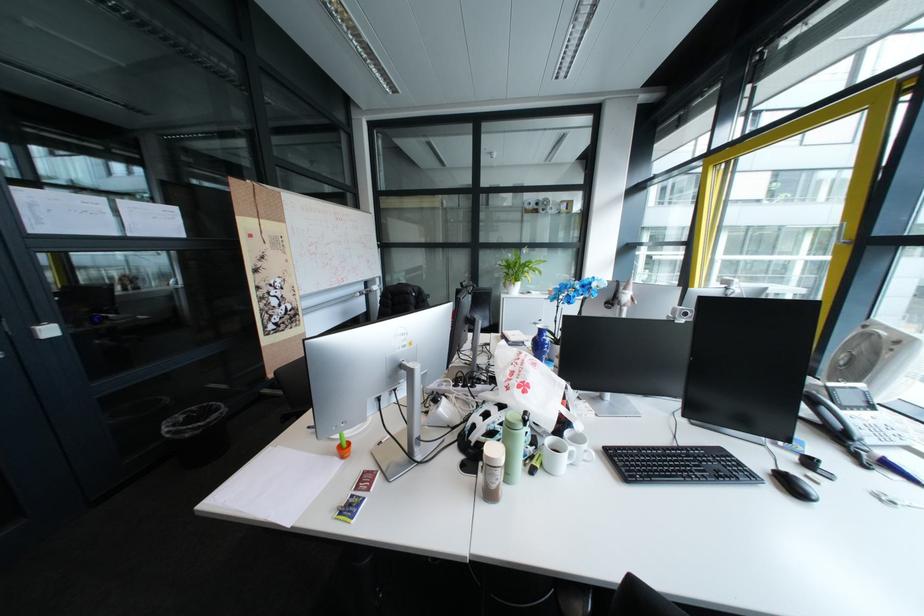
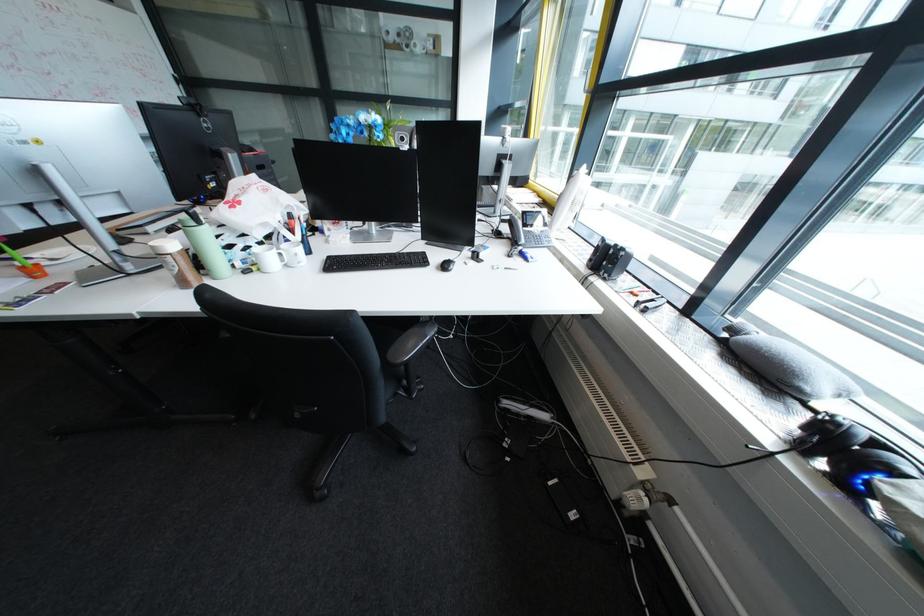
The first image is from the beginning of the video and the second image is from the end. How did the camera likely rotate when shooting the video?

The camera rotated toward right-down.